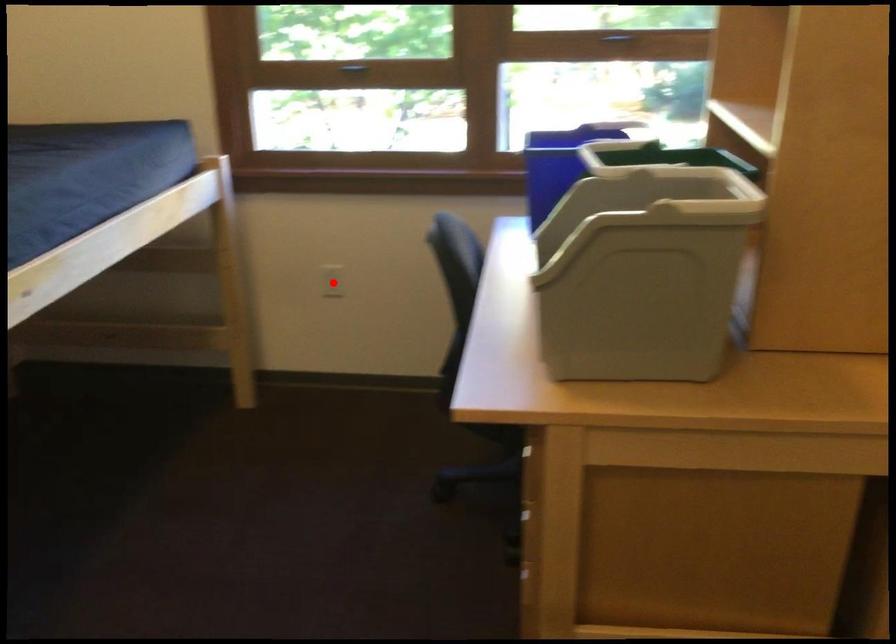
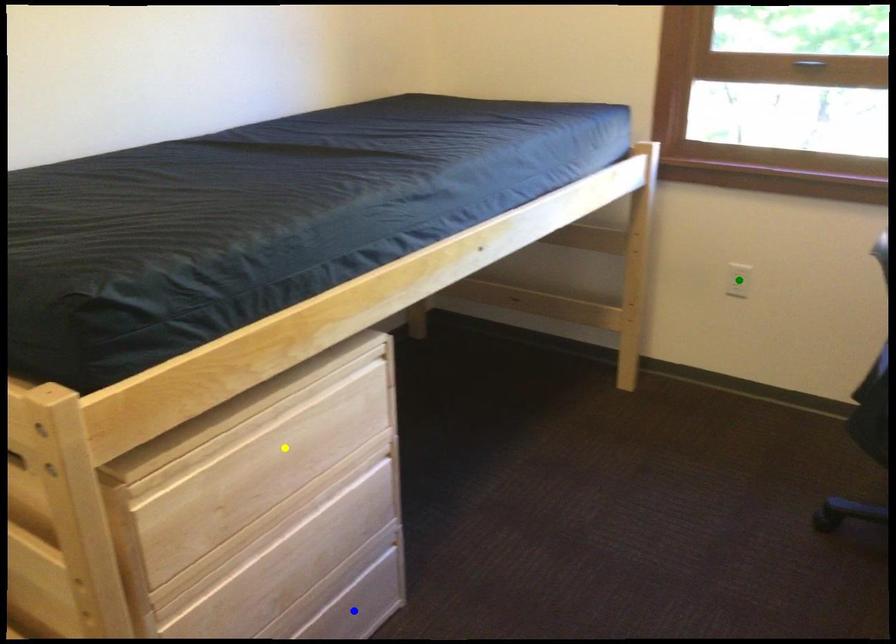
Question: I am providing you with two images of the same scene from different viewpoints. A red point is marked on the first image. You are given multiple points on the second image. Which spot in image 2 lines up with the point in image 1?

Choices:
 (A) blue point
 (B) green point
 (C) yellow point

Answer: (B)